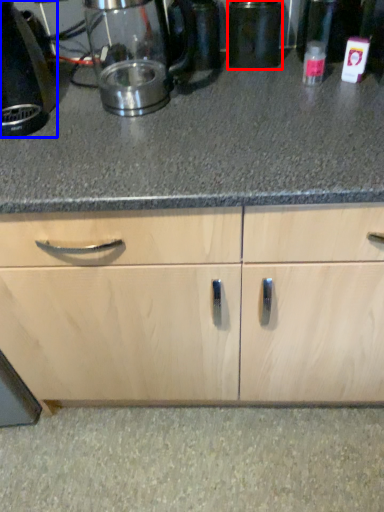
Question: Which of the following is the farthest to the observer, appliance (highlighted by a red box) or home appliance (highlighted by a blue box)?

Choices:
 (A) appliance
 (B) home appliance

Answer: (A)